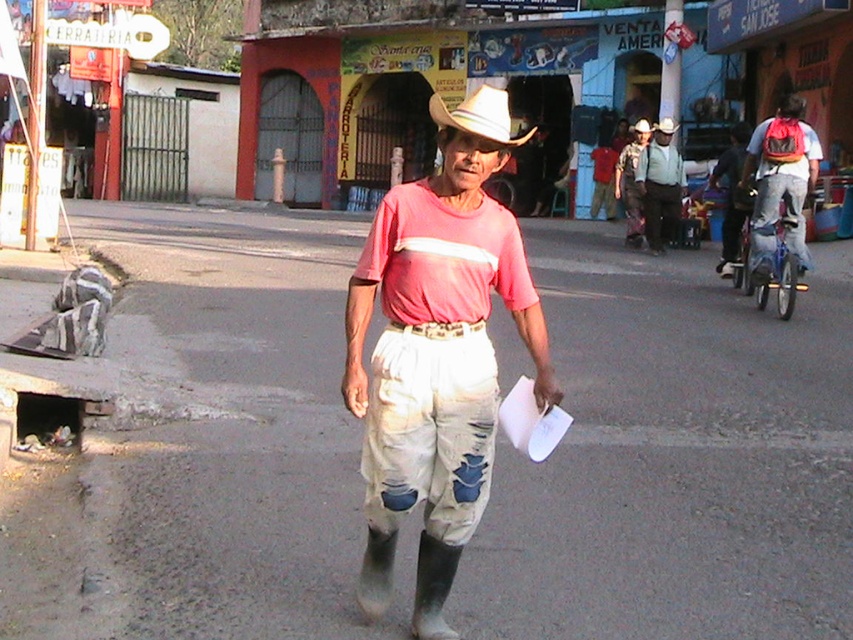
You are a tailor observing a man in the scene who is wearing two shirts. The man is facing you. Which shirt, the matte pink shirt at center or the light blue denim shirt at center, is narrower on his upper body?

The matte pink shirt at center has a lesser width compared to the light blue denim shirt at center, so the matte pink shirt at center is narrower on the man upper body.

In the scene shown: You are a fashion designer observing a man wearing a white felt cowboy hat at center and a matte red shirt at center. Which of these two items has a greater height?

The white felt cowboy hat at center has a greater height compared to the matte red shirt at center.

You are standing in the street scene described. You need to reach a specific location marked by the point at coordinates (474, 93). If you walk directly towards it, how far will you have to walk in feet?

The point at coordinates (474, 93) is 78.76 feet away from the viewer, so you would have to walk 78.76 feet to reach it.